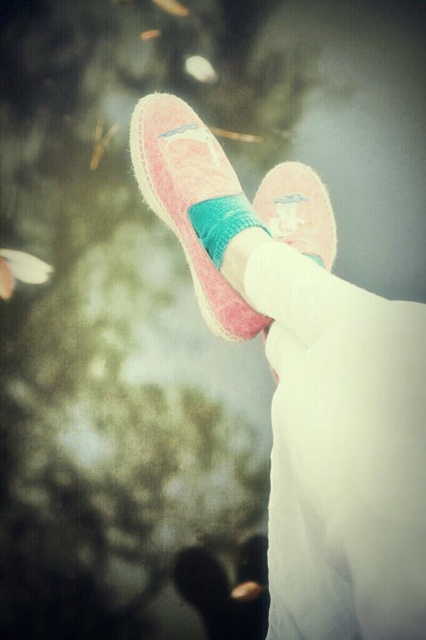
Is point (354, 529) positioned behind point (233, 300)?

No, (354, 529) is in front of (233, 300).

Does pink suede shoes at center appear on the right side of pink suede shoe at center?

Indeed, pink suede shoes at center is positioned on the right side of pink suede shoe at center.

The width and height of the screenshot is (426, 640). I want to click on pink suede shoes at center, so click(311, 401).

Who is higher up, pink suede shoes at center or pink suede toe at lower center?

pink suede shoes at center is above.

Does pink suede shoes at center have a larger size compared to pink suede toe at lower center?

Yes, pink suede shoes at center is bigger than pink suede toe at lower center.

Does point (167, 138) lie in front of point (244, 596)?

Yes, it is.

This screenshot has height=640, width=426. Identify the location of pink suede shoes at center. (311, 401).

Is pink suede shoes at center positioned at the back of teal soft sock at center?

No, pink suede shoes at center is in front of teal soft sock at center.

Is pink suede shoes at center shorter than teal soft sock at center?

Incorrect, pink suede shoes at center's height does not fall short of teal soft sock at center's.

Is point (276, 428) more distant than point (222, 241)?

No, (276, 428) is closer to viewer.

Find the location of a particular element. The image size is (426, 640). pink suede shoes at center is located at coordinates (311, 401).